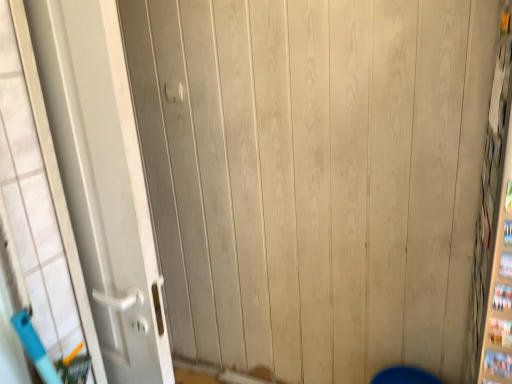
Question: Considering the relative positions of white matte door at left and white plastic door handle at upper center in the image provided, is white matte door at left to the left or to the right of white plastic door handle at upper center?

Choices:
 (A) right
 (B) left

Answer: (B)

Question: Does point (169, 364) appear closer or farther from the camera than point (167, 89)?

Choices:
 (A) farther
 (B) closer

Answer: (B)

Question: From the image's perspective, is white matte door at left above or below white plastic door handle at upper center?

Choices:
 (A) below
 (B) above

Answer: (A)

Question: In terms of height, does white plastic door handle at upper center look taller or shorter compared to white matte door at left?

Choices:
 (A) tall
 (B) short

Answer: (B)

Question: Based on their sizes in the image, would you say white plastic door handle at upper center is bigger or smaller than white matte door at left?

Choices:
 (A) big
 (B) small

Answer: (B)

Question: Is white plastic door handle at upper center inside the boundaries of white matte door at left, or outside?

Choices:
 (A) outside
 (B) inside

Answer: (A)

Question: From the image's perspective, is white plastic door handle at upper center positioned above or below white matte door at left?

Choices:
 (A) above
 (B) below

Answer: (A)